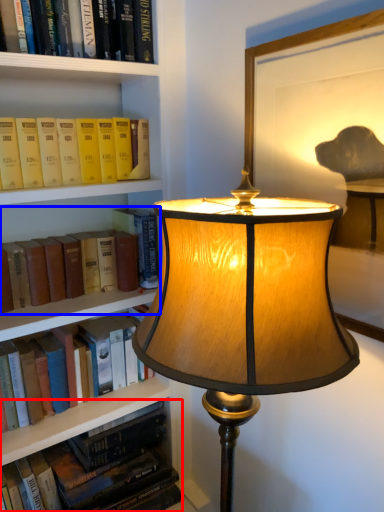
Question: Which object is closer to the camera taking this photo, book (highlighted by a red box) or book (highlighted by a blue box)?

Choices:
 (A) book
 (B) book

Answer: (B)